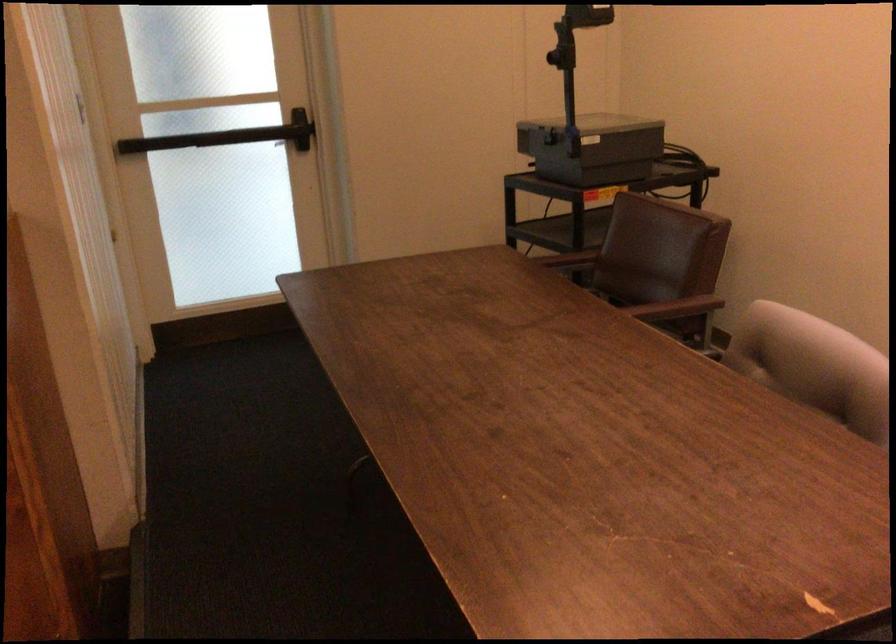
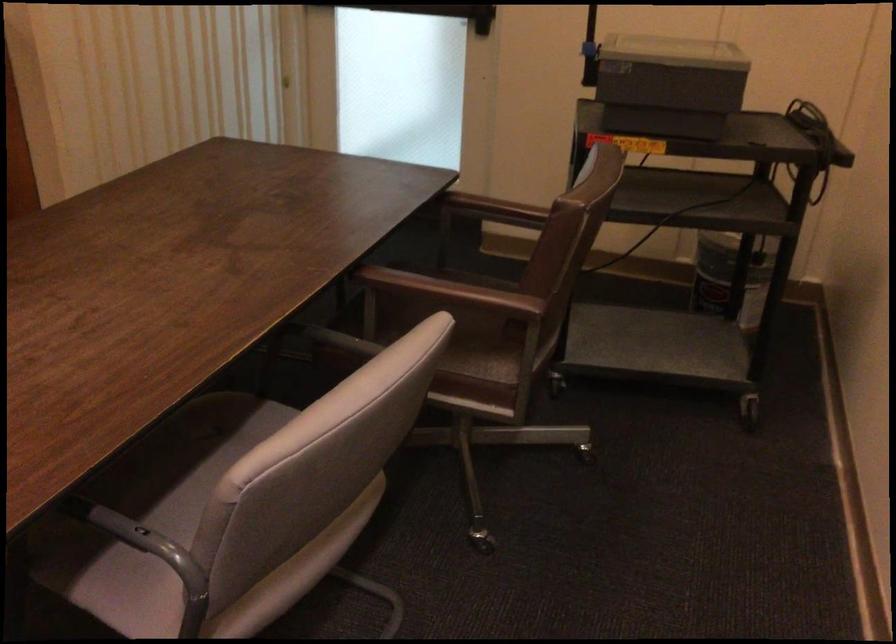
The point at (268, 138) is marked in the first image. Where is the corresponding point in the second image?

(437, 12)